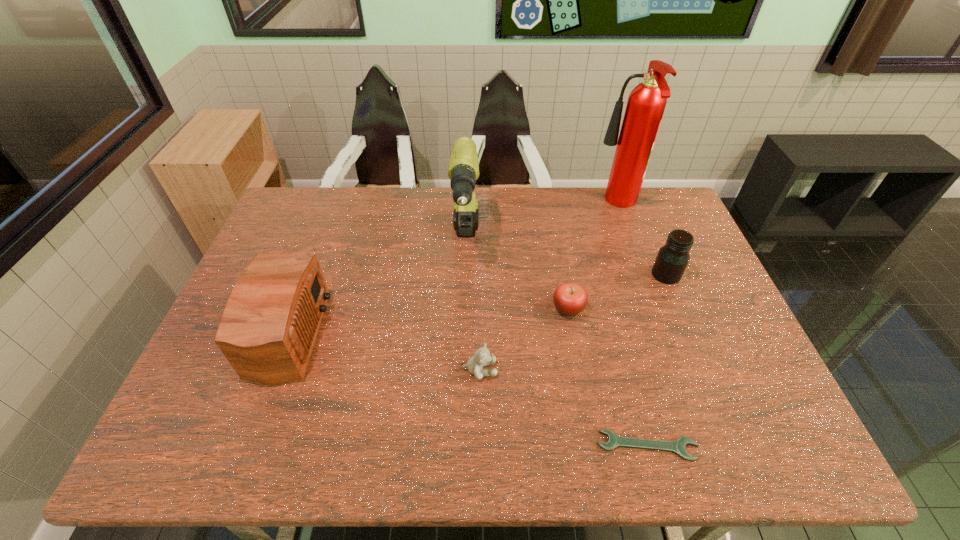
Find the location of a particular element. Image resolution: width=960 pixels, height=540 pixels. vacant area at the near right corner of the desktop is located at coordinates (799, 446).

The height and width of the screenshot is (540, 960). In order to click on vacant point located between the third tallest object and the wrench in this screenshot , I will do `click(463, 390)`.

Where is `vacant point located between the radio receiver and the fire extinguisher`? The image size is (960, 540). vacant point located between the radio receiver and the fire extinguisher is located at coordinates (447, 269).

Locate an element on the screen. free space between the apple and the sixth shortest object is located at coordinates (516, 276).

Where is `free space between the fourth shortest object and the tallest object`? The width and height of the screenshot is (960, 540). free space between the fourth shortest object and the tallest object is located at coordinates (641, 240).

Locate an element on the screen. vacant space in between the nearest object and the apple is located at coordinates (608, 377).

You are a GUI agent. You are given a task and a screenshot of the screen. Output one action in this format:
    pyautogui.click(x=<x>, y=<y>)
    Task: Click on the vacant space that is in between the fourth shortest object and the shortest object
    The height and width of the screenshot is (540, 960).
    Given the screenshot: What is the action you would take?
    pyautogui.click(x=657, y=360)

Identify the location of free spot between the third tallest object and the drill. (372, 288).

Where is `vacant area that lies between the fire extinguisher and the sixth shortest object`? vacant area that lies between the fire extinguisher and the sixth shortest object is located at coordinates (541, 224).

Where is `free space between the apple and the radio receiver`? free space between the apple and the radio receiver is located at coordinates (423, 321).